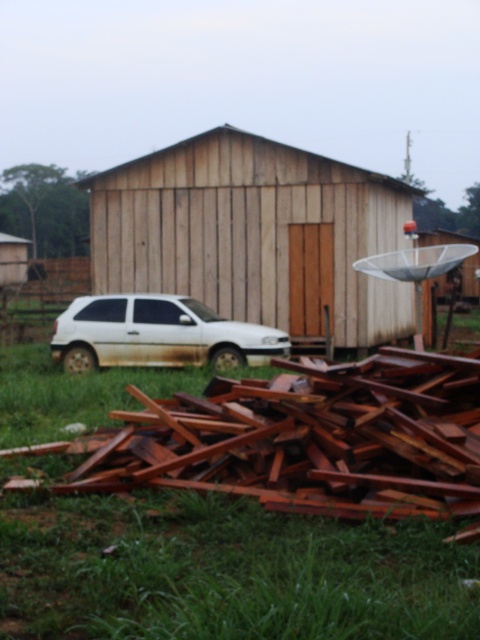
You are a delivery person who needs to park your vehicle in this area. The white matte car at lower left is already parked. Where should you avoid parking to ensure you donno block the green grass at lower center?

You should avoid parking over the green grass at lower center because the white matte car at lower left is currently positioned above it, and parking there would block access to or damage the green grass at lower center.

You are planning to mow the lawn in this rural area. The green grass at lower center and the white matte car at lower left are in your path. Which area requires more attention in terms of width when mowing?

The green grass at lower center requires more attention in terms of width when mowing because its width surpasses that of the white matte car at lower left.